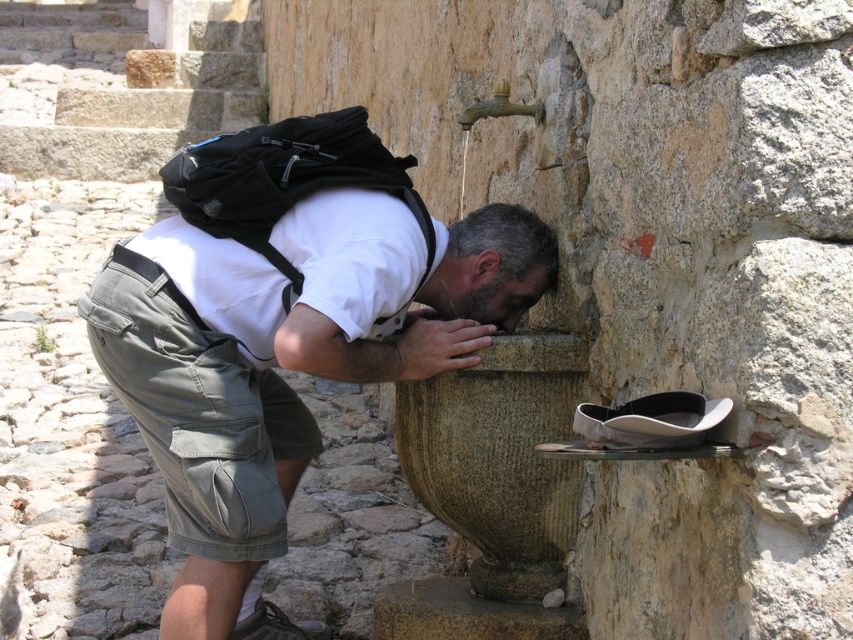
You are a photographer trying to capture the scene of the man drinking water from the fountain. You need to ensure both the matte khaki shorts at lower left and the black suede shoe at lower center are clearly visible in the shot. Based on their positions, which object should you focus on first to ensure both are in frame?

The matte khaki shorts at lower left is located above the black suede shoe at lower center. To ensure both are in frame, focus on the matte khaki shorts at lower left first as it is higher up, allowing the shoe to naturally fall into the lower part of the shot.

You are standing at the stone fountain and want to place a small plant between the two points marked as point (337, 305) and point (315, 628). Which point should the plant be closer to in order to be nearer to the viewer?

The plant should be placed closer to point (337, 305) because it is closer to the viewer than point (315, 628).

You are a photographer trying to capture the man drinking from the fountain. To ensure the matte khaki shorts at lower left are in the frame, where should you position your camera relative to the fountain?

The matte khaki shorts at lower left are located at point (286,358), so position the camera to include this coordinate in the frame to capture them.